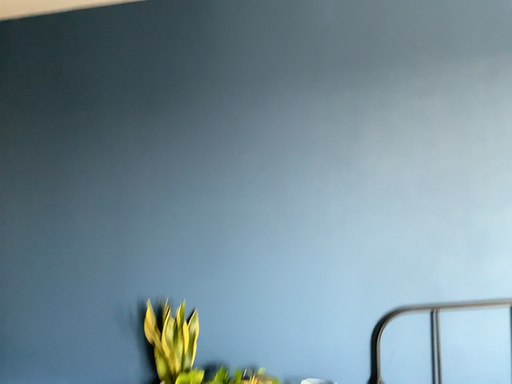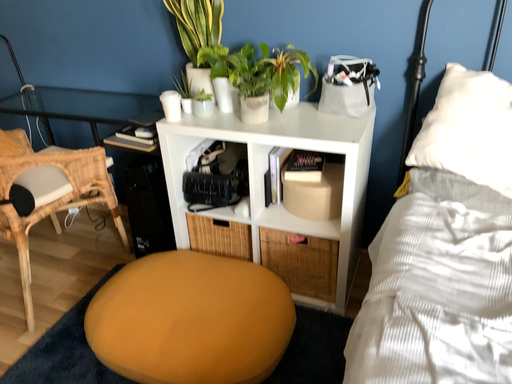
Question: Which way did the camera rotate in the video?

Choices:
 (A) rotated downward
 (B) rotated upward

Answer: (A)